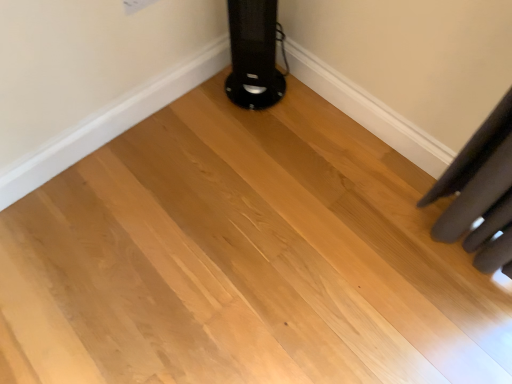
Identify the location of vacant area that is in front of black plastic speaker at center. (239, 121).